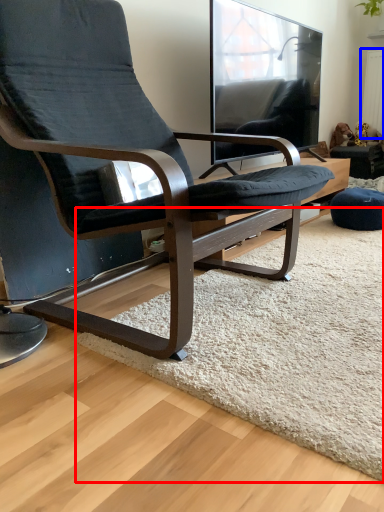
Question: Which object is closer to the camera taking this photo, mat (highlighted by a red box) or radiator (highlighted by a blue box)?

Choices:
 (A) mat
 (B) radiator

Answer: (A)